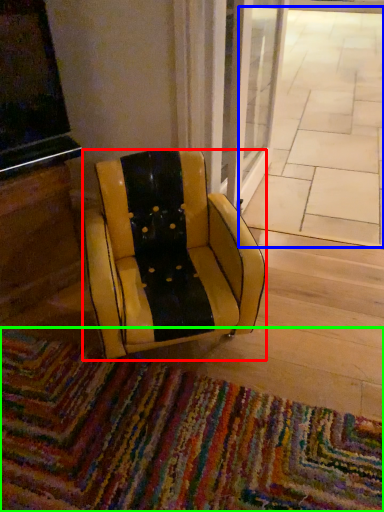
Question: Which object is positioned farthest from chair (highlighted by a red box)? Select from pavement (highlighted by a blue box) and mat (highlighted by a green box).

Choices:
 (A) pavement
 (B) mat

Answer: (A)